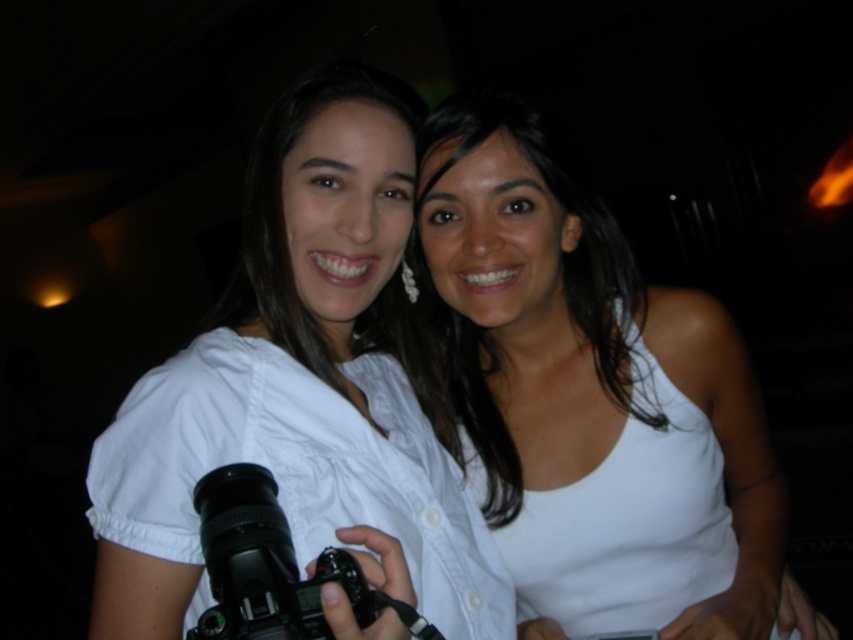
Question: Can you confirm if white matte tank top at center is positioned to the right of white matte camera at center?

Choices:
 (A) yes
 (B) no

Answer: (A)

Question: Does white matte camera at center appear under black plastic camera at center?

Choices:
 (A) yes
 (B) no

Answer: (B)

Question: Based on their relative distances, which object is nearer to the white matte camera at center?

Choices:
 (A) black plastic camera at center
 (B) white matte tank top at center

Answer: (B)

Question: Does white matte tank top at center come in front of white matte camera at center?

Choices:
 (A) no
 (B) yes

Answer: (A)

Question: Considering the real-world distances, which object is closest to the white matte tank top at center?

Choices:
 (A) black plastic camera at center
 (B) white matte camera at center

Answer: (B)

Question: Which object appears farthest from the camera in this image?

Choices:
 (A) black plastic camera at center
 (B) white matte tank top at center
 (C) white matte camera at center

Answer: (B)